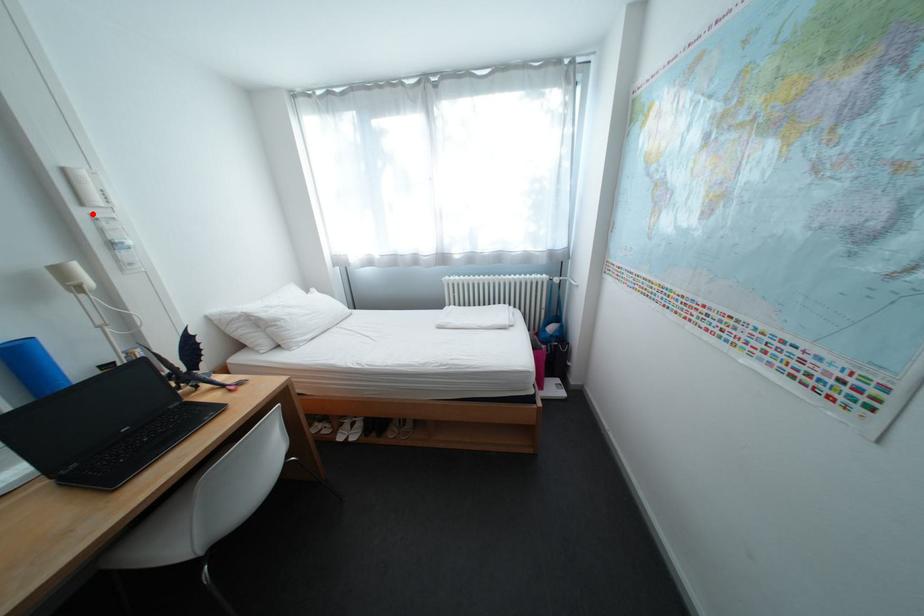
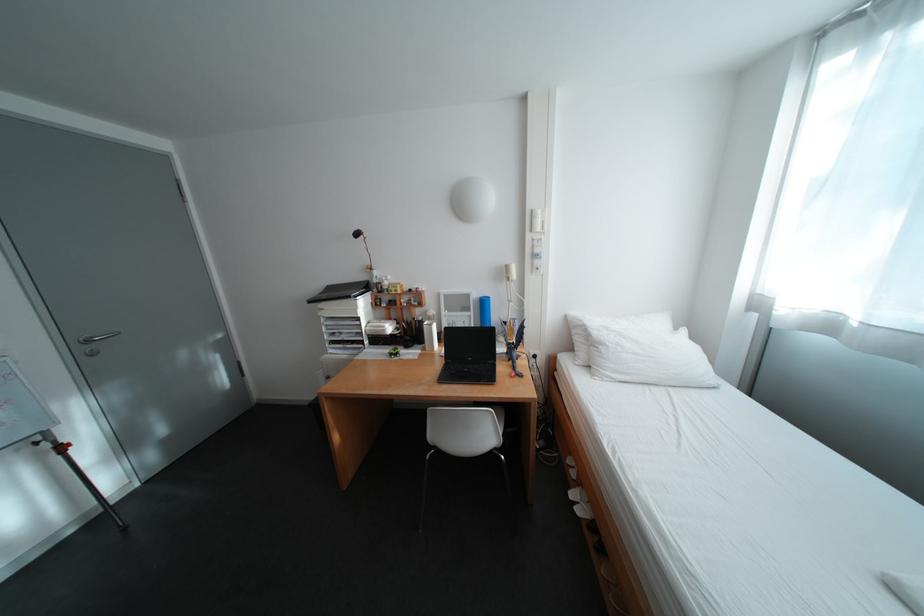
The point at the highlighted location is marked in the first image. Where is the corresponding point in the second image?

(541, 237)